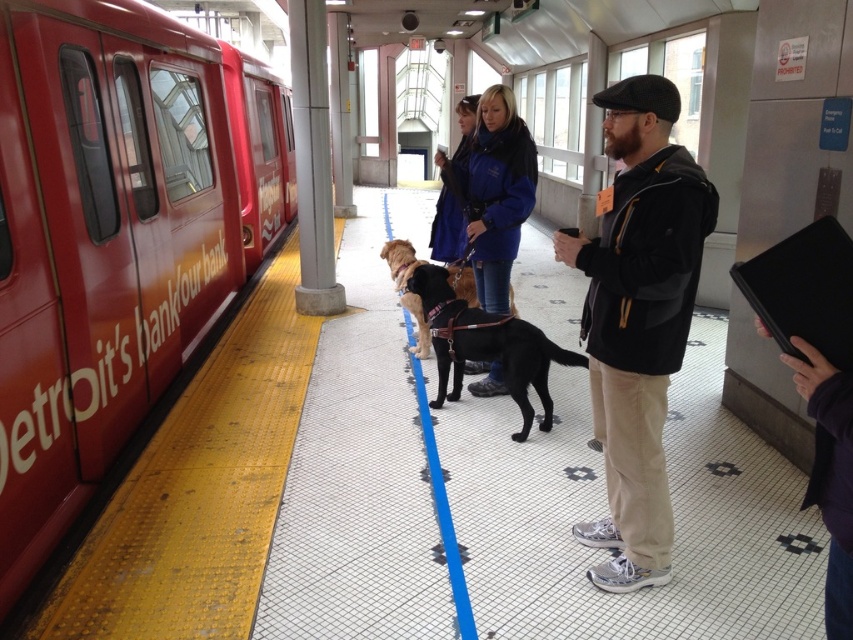
You are waiting for the train at the station and see a black matte jacket at center and a purple fabric at right. Which one is more to the left?

The black matte jacket at center is more to the left than the purple fabric at right.